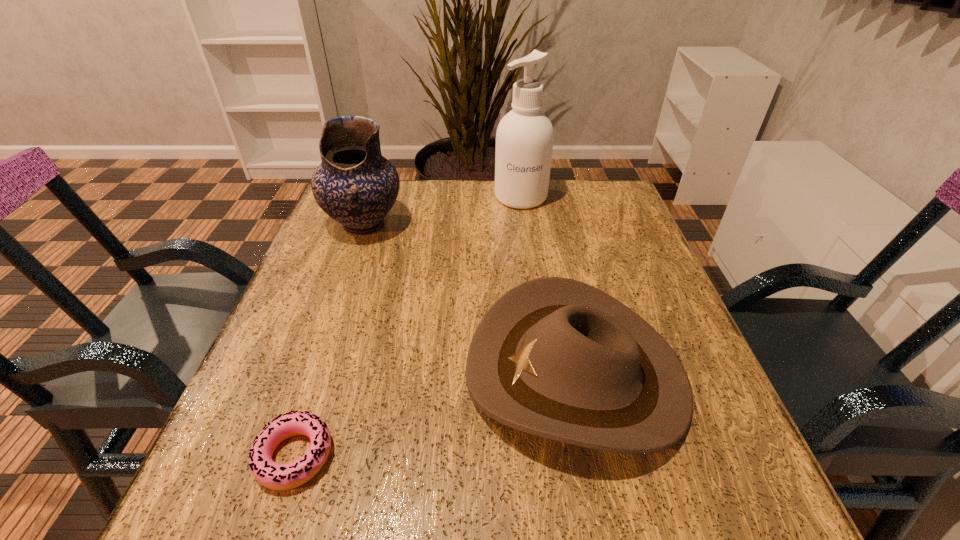
Where is `free space between the pottery and the cowboy hat`? free space between the pottery and the cowboy hat is located at coordinates (470, 299).

This screenshot has width=960, height=540. Identify the location of vacant space in between the cleansing agent and the doughnut. (408, 326).

Identify the location of empty space between the shortest object and the tallest object. (408, 326).

Identify which object is located as the third nearest to the cowboy hat. Please provide its 2D coordinates. Your answer should be formatted as a tuple, i.e. [(x, y)], where the tuple contains the x and y coordinates of a point satisfying the conditions above.

[(524, 139)]

The width and height of the screenshot is (960, 540). Identify the location of object that stands as the second closest to the second shortest object. (355, 185).